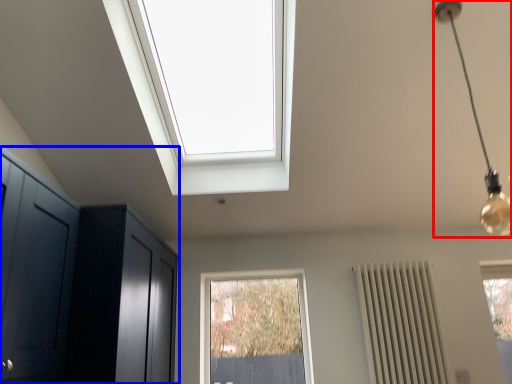
Question: Which point is closer to the camera, light fixture (highlighted by a red box) or dresser (highlighted by a blue box)?

Choices:
 (A) light fixture
 (B) dresser

Answer: (A)